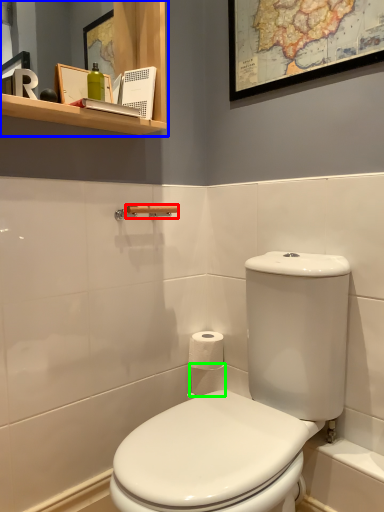
Question: Based on their relative distances, which object is nearer to towel bar (highlighted by a red box)? Choose from bathroom cabinet (highlighted by a blue box) and toilet paper (highlighted by a green box).

Choices:
 (A) bathroom cabinet
 (B) toilet paper

Answer: (A)